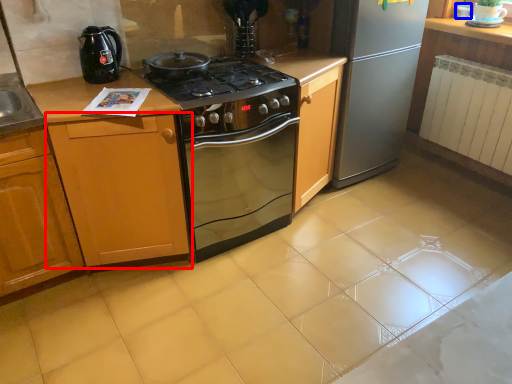
Question: Which point is closer to the camera, cabinetry (highlighted by a red box) or appliance (highlighted by a blue box)?

Choices:
 (A) cabinetry
 (B) appliance

Answer: (A)